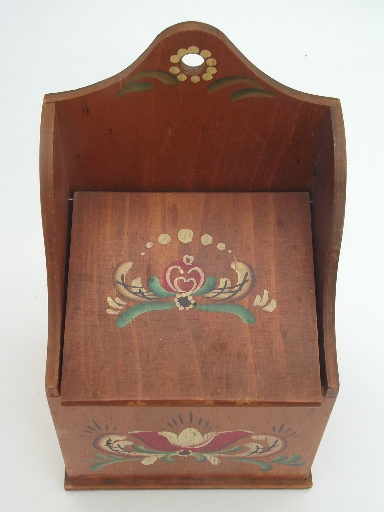
Identify the location of pin hinge. (71, 199), (311, 201).